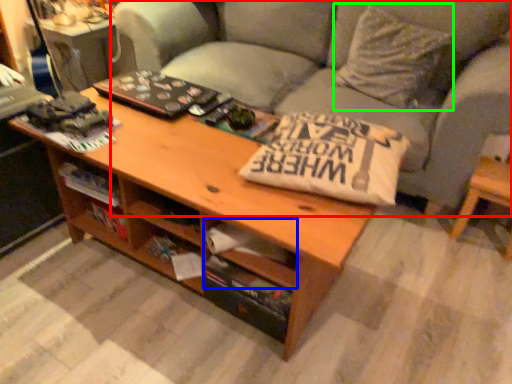
Question: Considering the real-world distances, which object is closest to studio couch (highlighted by a red box)? drawer (highlighted by a blue box) or throw pillow (highlighted by a green box).

Choices:
 (A) drawer
 (B) throw pillow

Answer: (B)